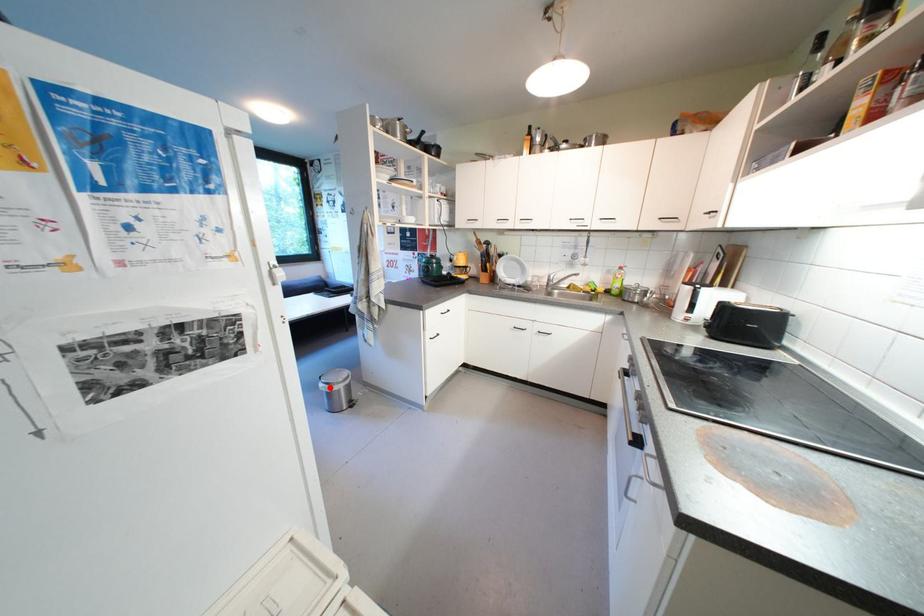
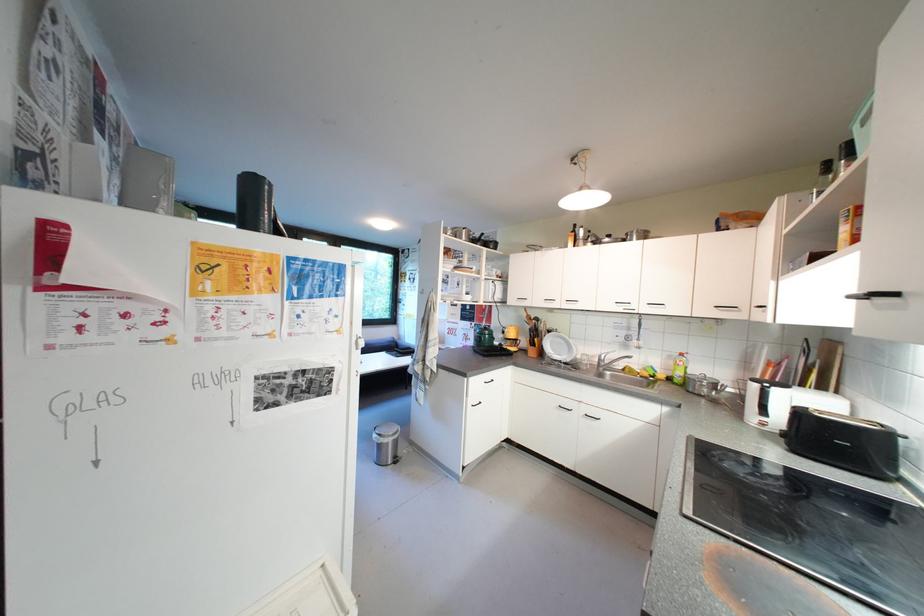
Question: I am providing you with two images of the same scene from different viewpoints. A red point is shown in image1. For the corresponding object point in image2, is it positioned nearer or farther from the camera?

Choices:
 (A) Nearer
 (B) Farther

Answer: (A)